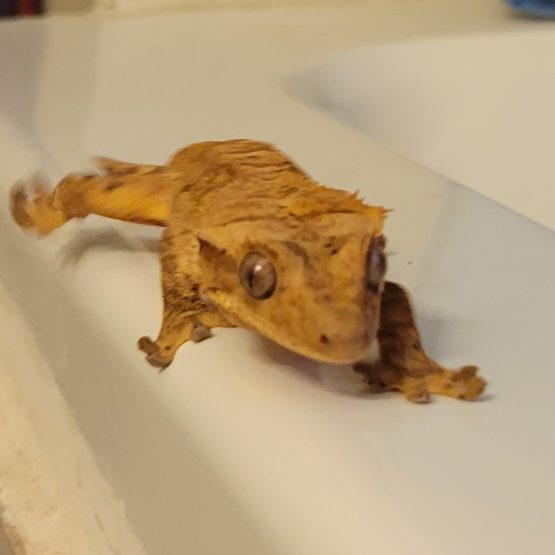
Identify the location of white sink. (492, 119).